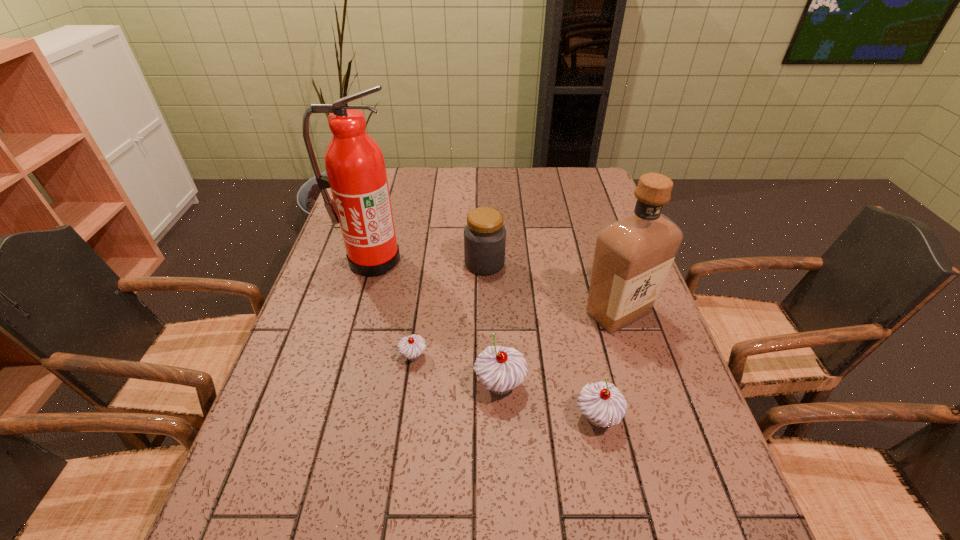
Where is `free space between the second cupcake from right to left and the shortest object`? free space between the second cupcake from right to left and the shortest object is located at coordinates (457, 370).

Locate an element on the screen. empty space between the fire extinguisher and the rightmost cupcake is located at coordinates (485, 339).

At what (x,y) coordinates should I click in order to perform the action: click on empty space between the second tallest cupcake and the second cupcake from right to left. Please return your answer as a coordinate pair (x, y). The width and height of the screenshot is (960, 540). Looking at the image, I should click on (549, 401).

The width and height of the screenshot is (960, 540). In order to click on free spot between the rightmost cupcake and the fourth nearest object in this screenshot , I will do `click(608, 365)`.

Where is `free space between the second shortest cupcake and the jar`? The width and height of the screenshot is (960, 540). free space between the second shortest cupcake and the jar is located at coordinates (541, 340).

Locate which object is the third closest to the second cupcake from right to left. Please provide its 2D coordinates. Your answer should be formatted as a tuple, i.e. [(x, y)], where the tuple contains the x and y coordinates of a point satisfying the conditions above.

[(633, 255)]

Locate which object ranks second in proximity to the second shortest cupcake. Please provide its 2D coordinates. Your answer should be formatted as a tuple, i.e. [(x, y)], where the tuple contains the x and y coordinates of a point satisfying the conditions above.

[(633, 255)]

Where is `the third closest cupcake to the jar`? The height and width of the screenshot is (540, 960). the third closest cupcake to the jar is located at coordinates (603, 404).

This screenshot has height=540, width=960. I want to click on cupcake that is the nearest to the jar, so click(x=411, y=347).

Locate an element on the screen. The height and width of the screenshot is (540, 960). vacant space that satisfies the following two spatial constraints: 1. on the front side of the second cupcake from right to left; 2. on the right side of the second tallest cupcake is located at coordinates (501, 417).